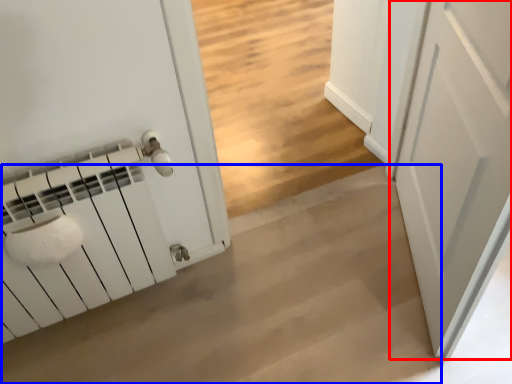
Question: Which object appears farthest to the camera in this image, door (highlighted by a red box) or concrete (highlighted by a blue box)?

Choices:
 (A) door
 (B) concrete

Answer: (B)